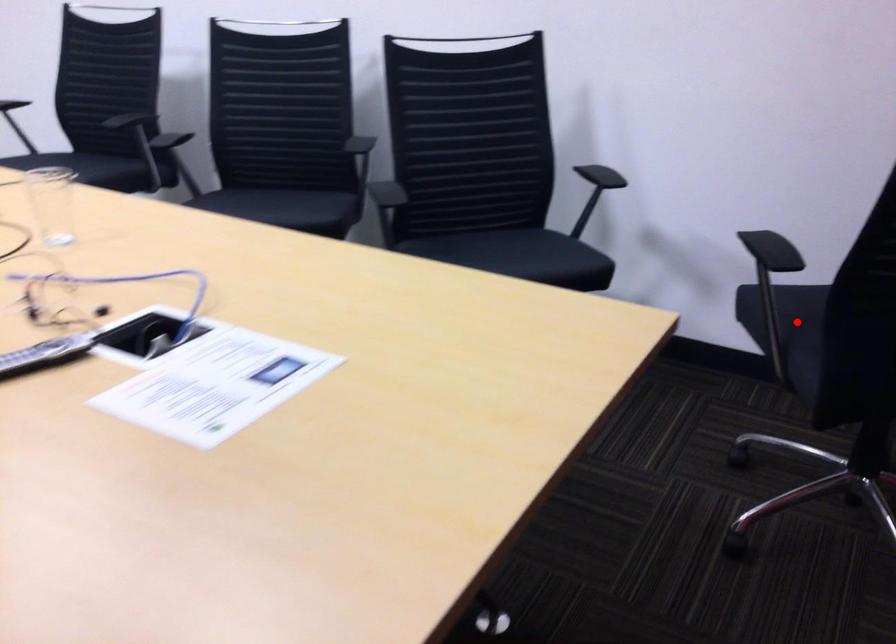
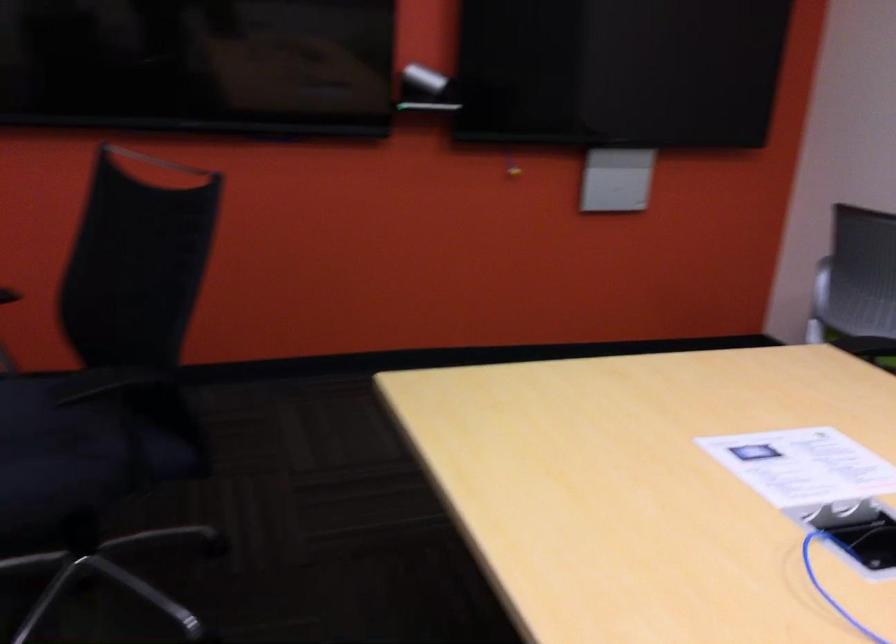
In the second image, find the point that corresponds to the highlighted location in the first image.

(82, 450)